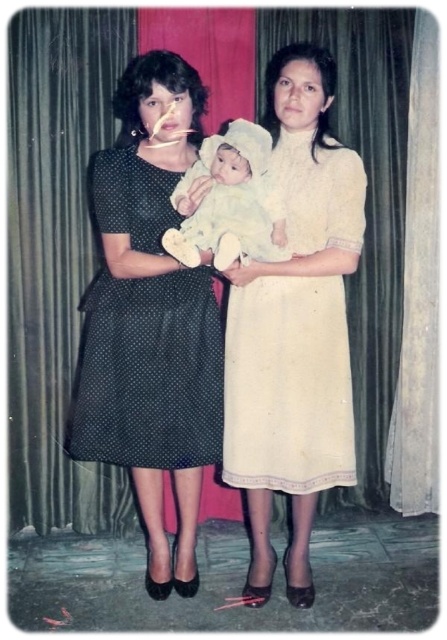
Can you confirm if black dotted dress at center is wider than white soft baby at center?

Correct, the width of black dotted dress at center exceeds that of white soft baby at center.

Does point (117, 320) lie behind point (169, 243)?

That is True.

This screenshot has width=447, height=640. I want to click on black dotted dress at center, so click(x=144, y=336).

Between creamy soft fabric dress at center and black dotted dress at center, which one has more height?

creamy soft fabric dress at center is taller.

Consider the image. Is creamy soft fabric dress at center above black dotted dress at center?

→ No, creamy soft fabric dress at center is not above black dotted dress at center.

Describe the element at coordinates (287, 387) in the screenshot. I see `creamy soft fabric dress at center` at that location.

Where is `creamy soft fabric dress at center`? The height and width of the screenshot is (640, 447). creamy soft fabric dress at center is located at coordinates (287, 387).

This screenshot has width=447, height=640. Describe the element at coordinates (287, 387) in the screenshot. I see `creamy soft fabric dress at center` at that location.

Does point (307, 392) come farther from viewer compared to point (272, 216)?

Yes, it is.

Where is `creamy soft fabric dress at center`? Image resolution: width=447 pixels, height=640 pixels. creamy soft fabric dress at center is located at coordinates (287, 387).